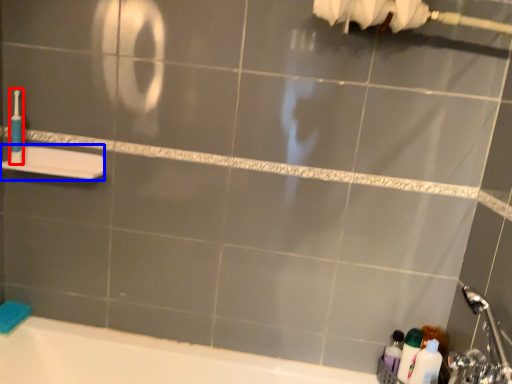
Question: Which object is closer to the camera taking this photo, toothbrush (highlighted by a red box) or towel bar (highlighted by a blue box)?

Choices:
 (A) toothbrush
 (B) towel bar

Answer: (B)